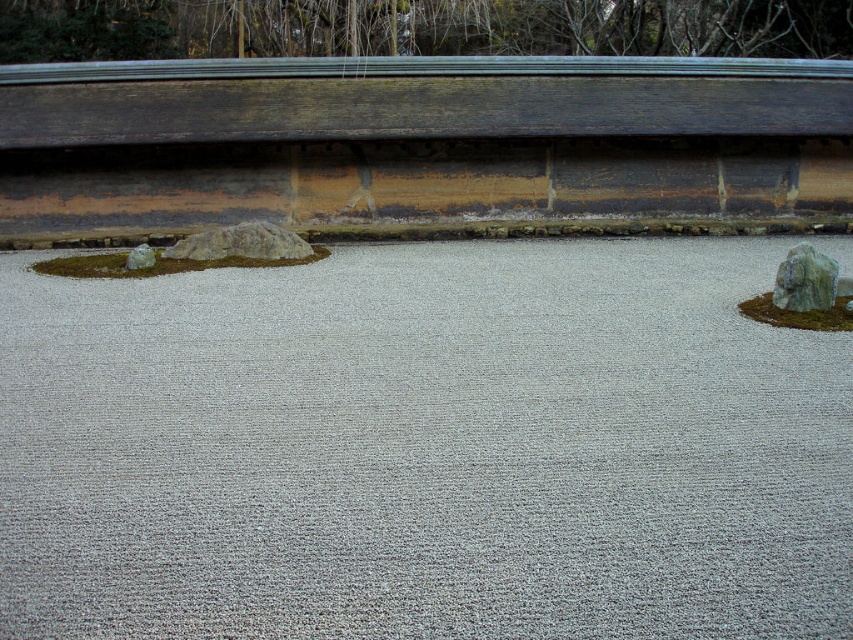
Is green moss at left bigger than green mossy rock at right?

Yes, green moss at left is bigger than green mossy rock at right.

Between point (280, 262) and point (810, 246), which one is positioned in front?

Positioned in front is point (810, 246).

Describe the element at coordinates (157, 264) in the screenshot. The height and width of the screenshot is (640, 853). I see `green moss at left` at that location.

You are a GUI agent. You are given a task and a screenshot of the screen. Output one action in this format:
    pyautogui.click(x=<x>, y=<y>)
    Task: Click on the green moss at left
    The width and height of the screenshot is (853, 640).
    Given the screenshot: What is the action you would take?
    pyautogui.click(x=157, y=264)

Between green moss at left and smooth gray rock at left, which one is positioned higher?

green moss at left is above.

Is green moss at left positioned in front of smooth gray rock at left?

Yes, it is in front of smooth gray rock at left.

The image size is (853, 640). Describe the element at coordinates (157, 264) in the screenshot. I see `green moss at left` at that location.

I want to click on green moss at left, so [157, 264].

Does gray rough rock at center have a lesser height compared to smooth gray rock at right?

No, gray rough rock at center is not shorter than smooth gray rock at right.

You are a GUI agent. You are given a task and a screenshot of the screen. Output one action in this format:
    pyautogui.click(x=<x>, y=<y>)
    Task: Click on the gray rough rock at center
    
    Given the screenshot: What is the action you would take?
    pyautogui.click(x=241, y=243)